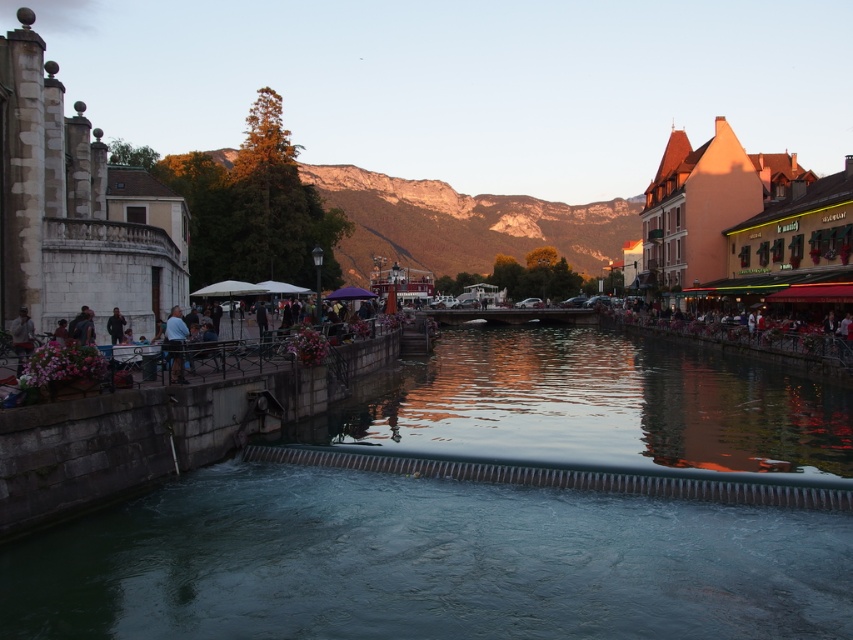
Which of these two, rustic stone mountain at upper center or light blue jeans at left, stands taller?

rustic stone mountain at upper center

What are the coordinates of `rustic stone mountain at upper center` in the screenshot? It's located at 461,224.

Is point (584, 260) less distant than point (171, 342)?

No, (584, 260) is behind (171, 342).

Find the location of a particular element. This screenshot has width=853, height=640. rustic stone mountain at upper center is located at coordinates (461, 224).

Who is shorter, smooth concrete wall at center or light brown leather jacket at lower left?

light brown leather jacket at lower left is shorter.

Can you confirm if smooth concrete wall at center is shorter than light brown leather jacket at lower left?

No, smooth concrete wall at center is not shorter than light brown leather jacket at lower left.

This screenshot has width=853, height=640. Describe the element at coordinates (598, 404) in the screenshot. I see `smooth concrete wall at center` at that location.

At what (x,y) coordinates should I click in order to perform the action: click on smooth concrete wall at center. Please return your answer as a coordinate pair (x, y). The image size is (853, 640). Looking at the image, I should click on pyautogui.click(x=598, y=404).

Can you confirm if smooth concrete river at center is thinner than matte orange building at right?

Incorrect, smooth concrete river at center's width is not less than matte orange building at right's.

Is point (746, 552) farther from viewer compared to point (651, 244)?

No, (746, 552) is in front of (651, 244).

I want to click on smooth concrete river at center, so click(x=424, y=563).